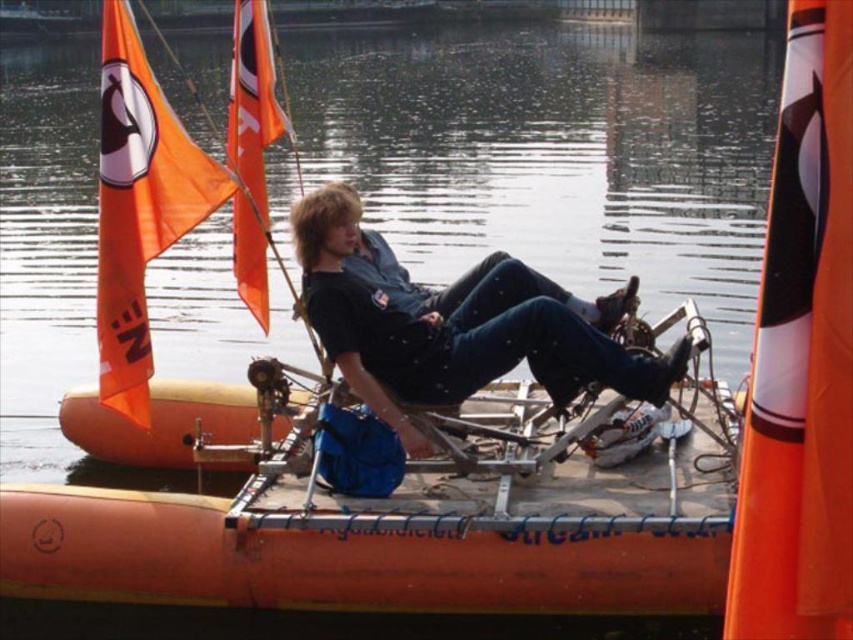
Is transparent water at center in front of black matte shirt at center?

No, transparent water at center is further to the viewer.

Does transparent water at center have a greater width compared to black matte shirt at center?

Yes.

Who is more distant from viewer, (283, 344) or (325, 321)?

Point (283, 344)

This screenshot has width=853, height=640. In order to click on transparent water at center in this screenshot , I will do `click(555, 154)`.